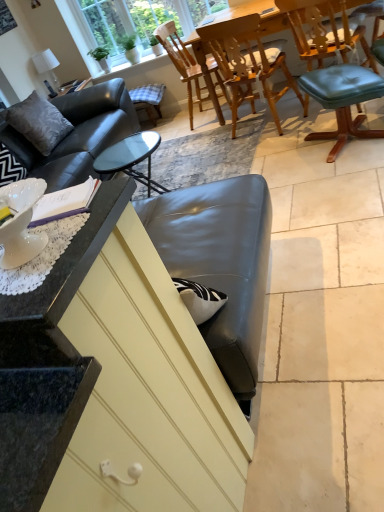
What do you see at coordinates (69, 262) in the screenshot? The width and height of the screenshot is (384, 512). I see `black granite countertop at left` at bounding box center [69, 262].

Find the location of a particular element. This screenshot has width=384, height=512. black granite countertop at left is located at coordinates (69, 262).

The height and width of the screenshot is (512, 384). Describe the element at coordinates (137, 20) in the screenshot. I see `clear glass window at upper center` at that location.

In order to face teal leather bar stool at right, placed as the 2th bar stool when sorted from top to bottom, should I rotate leftwards or rightwards?

Rotate right and turn 19.571 degrees.

This screenshot has height=512, width=384. What do you see at coordinates (259, 14) in the screenshot? I see `teak wood dining table at center` at bounding box center [259, 14].

What do you see at coordinates (38, 122) in the screenshot?
I see `gray suede pillow at upper left` at bounding box center [38, 122].

Describe the element at coordinates (148, 99) in the screenshot. I see `plaid fabric bar stool at center, which is the first bar stool in top-to-bottom order` at that location.

Image resolution: width=384 pixels, height=512 pixels. What are the coordinates of `wooden chair at upper center, marked as the third chair in a right-to-left arrangement` in the screenshot? It's located at (182, 63).

From a real-world perspective, who is located higher, wooden chair at upper center, marked as the third chair in a right-to-left arrangement, or wooden chair at center, placed as the second chair when sorted from right to left?

A: wooden chair at center, placed as the second chair when sorted from right to left.

Is wooden chair at center, placed as the second chair when sorted from right to left, located within wooden chair at upper center, marked as the third chair in a right-to-left arrangement?

Actually, wooden chair at center, placed as the second chair when sorted from right to left, is outside wooden chair at upper center, marked as the third chair in a right-to-left arrangement.

From the image's perspective, is wooden chair at upper center, the 1th chair from the left, positioned above or below wooden chair at center, placed as the second chair when sorted from right to left?

wooden chair at upper center, the 1th chair from the left, is above wooden chair at center, placed as the second chair when sorted from right to left.

Identify the location of bar stool behind the teak wood dining table at center. (148, 99).

Consider the image. From the image's perspective, which one is positioned higher, teak wood dining table at center or plaid fabric bar stool at center, which is the first bar stool in top-to-bottom order?

teak wood dining table at center appears higher in the image.

Is teak wood dining table at center not near plaid fabric bar stool at center, which ranks as the 1th bar stool in back-to-front order?

teak wood dining table at center is far away from plaid fabric bar stool at center, which ranks as the 1th bar stool in back-to-front order.

Can you confirm if wooden chair at center, marked as the second chair in a left-to-right arrangement, is positioned to the right of clear glass window at upper center?

Yes, wooden chair at center, marked as the second chair in a left-to-right arrangement, is to the right of clear glass window at upper center.

Between wooden chair at center, marked as the second chair in a left-to-right arrangement, and clear glass window at upper center, which one is positioned in front?

Positioned in front is wooden chair at center, marked as the second chair in a left-to-right arrangement.

In terms of height, does wooden chair at center, placed as the second chair when sorted from right to left, look taller or shorter compared to clear glass window at upper center?

wooden chair at center, placed as the second chair when sorted from right to left, is taller than clear glass window at upper center.

The image size is (384, 512). What are the coordinates of `the 1st chair directly beneath the clear glass window at upper center (from a real-world perspective)` in the screenshot? It's located at (247, 63).

Could you tell me if gray suede pillow at upper left is facing clear glass window at upper center?

No, gray suede pillow at upper left is not aimed at clear glass window at upper center.

Is the position of gray suede pillow at upper left less distant than that of clear glass window at upper center?

Yes, the depth of gray suede pillow at upper left is less than that of clear glass window at upper center.

Considering the relative positions of gray suede pillow at upper left and clear glass window at upper center in the image provided, is gray suede pillow at upper left to the left or to the right of clear glass window at upper center?

gray suede pillow at upper left is to the left of clear glass window at upper center.

Between gray suede pillow at upper left and clear glass window at upper center, which one has smaller size?

gray suede pillow at upper left.

From the image's perspective, which is below, black granite countertop at left or plaid fabric bar stool at center, the 1th bar stool from the left?

black granite countertop at left appears lower in the image.

From a real-world perspective, is black granite countertop at left over plaid fabric bar stool at center, which ranks as the 1th bar stool in back-to-front order?

Correct, in the physical world, black granite countertop at left is higher than plaid fabric bar stool at center, which ranks as the 1th bar stool in back-to-front order.

Is black granite countertop at left positioned beyond the bounds of plaid fabric bar stool at center, positioned as the second bar stool in right-to-left order?

black granite countertop at left lies outside plaid fabric bar stool at center, positioned as the second bar stool in right-to-left order,'s area.

Is clear glass window at upper center facing towards wooden chair at upper center, the 1th chair from the left?

No, clear glass window at upper center is not turned towards wooden chair at upper center, the 1th chair from the left.

Is clear glass window at upper center spatially inside wooden chair at upper center, the 1th chair from the left, or outside of it?

clear glass window at upper center is outside wooden chair at upper center, the 1th chair from the left.

There is a clear glass window at upper center. At what (x,y) coordinates should I click in order to perform the action: click on the 1st chair below it (from the image's perspective). Please return your answer as a coordinate pair (x, y). This screenshot has width=384, height=512. Looking at the image, I should click on (182, 63).

Is clear glass window at upper center placed right next to wooden chair at upper center, the 1th chair from the left?

clear glass window at upper center and wooden chair at upper center, the 1th chair from the left, are clearly separated.

From a real-world perspective, which object stands above the other?

In real-world perspective, clear glass window at upper center is above.

Which object is further away from the camera, clear glass window at upper center or teal leather bar stool at right, placed as the 2th bar stool when sorted from back to front?

clear glass window at upper center is more distant.

Looking at this image, can you confirm if clear glass window at upper center is taller than teal leather bar stool at right, the first bar stool positioned from the bottom?

Yes, clear glass window at upper center is taller than teal leather bar stool at right, the first bar stool positioned from the bottom.

Is clear glass window at upper center positioned with its back to teal leather bar stool at right, marked as the 1th bar stool in a front-to-back arrangement?

No, clear glass window at upper center's orientation is not away from teal leather bar stool at right, marked as the 1th bar stool in a front-to-back arrangement.

From a real-world perspective, starting from the wooden chair at center, marked as the second chair in a left-to-right arrangement, which chair is the 1st one below it? Please provide its 2D coordinates.

[(182, 63)]

The height and width of the screenshot is (512, 384). I want to click on table to the right of plaid fabric bar stool at center, which is the first bar stool in top-to-bottom order, so click(x=259, y=14).

In the scene shown: Considering their positions, is wooden chair at upper center, the 1th chair from the left, positioned further to wooden chair at center, placed as the second chair when sorted from right to left, than plaid fabric bar stool at center, positioned as the second bar stool in right-to-left order?

plaid fabric bar stool at center, positioned as the second bar stool in right-to-left order, lies further to wooden chair at center, placed as the second chair when sorted from right to left, than the other object.

Considering their positions, is teak wood dining table at center positioned closer to gray suede pillow at upper left than wooden chair at center, marked as the second chair in a left-to-right arrangement?

Based on the image, wooden chair at center, marked as the second chair in a left-to-right arrangement, appears to be nearer to gray suede pillow at upper left.

Looking at the image, which one is located further to wooden chair at upper center, the 1th chair from the left, teal leather bar stool at right, placed as the 2th bar stool when sorted from back to front, or black granite countertop at left?

black granite countertop at left is further to wooden chair at upper center, the 1th chair from the left.

From the image, which object appears to be nearer to wooden chair at upper center, the 1th chair from the left, teal leather bar stool at right, placed as the 2th bar stool when sorted from top to bottom, or gray suede pillow at upper left?

teal leather bar stool at right, placed as the 2th bar stool when sorted from top to bottom, lies closer to wooden chair at upper center, the 1th chair from the left, than the other object.

Considering their positions, is clear glass window at upper center positioned further to plaid fabric bar stool at center, the 2th bar stool from the bottom, than wooden chair at center, placed as the second chair when sorted from right to left?

The object further to plaid fabric bar stool at center, the 2th bar stool from the bottom, is wooden chair at center, placed as the second chair when sorted from right to left.

Considering their positions, is clear glass window at upper center positioned closer to wooden chair at center, placed as the second chair when sorted from right to left, than wooden chair at upper center, marked as the third chair in a right-to-left arrangement?

wooden chair at upper center, marked as the third chair in a right-to-left arrangement, is closer to wooden chair at center, placed as the second chair when sorted from right to left.

Estimate the real-world distances between objects in this image. Which object is further from teal leather bar stool at right, the first bar stool positioned from the bottom, clear glass window at upper center or teal leather chair at right, the 1th chair viewed from the right?

clear glass window at upper center is positioned further to the anchor teal leather bar stool at right, the first bar stool positioned from the bottom.

When comparing their distances from teal leather chair at right, the 1th chair viewed from the right, does gray suede pillow at upper left or black granite countertop at left seem further?

black granite countertop at left lies further to teal leather chair at right, the 1th chair viewed from the right, than the other object.

I want to click on window between gray suede pillow at upper left and teal leather bar stool at right, acting as the first bar stool starting from the right, from left to right, so click(137, 20).

The image size is (384, 512). In order to click on table situated between gray suede pillow at upper left and teal leather bar stool at right, acting as the first bar stool starting from the right, from left to right in this screenshot , I will do `click(259, 14)`.

Identify the location of table between black granite countertop at left and wooden chair at upper center, marked as the third chair in a right-to-left arrangement, from front to back. (259, 14).

The width and height of the screenshot is (384, 512). I want to click on window positioned between wooden chair at center, placed as the second chair when sorted from right to left, and plaid fabric bar stool at center, which is the first bar stool in top-to-bottom order, from near to far, so click(137, 20).